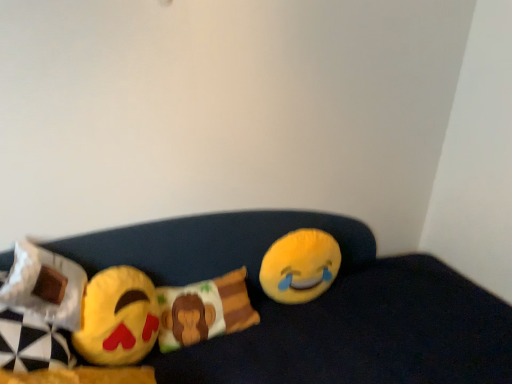
Question: From a real-world perspective, is yellow plush at right, positioned as the second toy in left-to-right order, under white fabric pillow at left, the 1th pillow viewed from the front?

Choices:
 (A) no
 (B) yes

Answer: (B)

Question: Is yellow plush at right, the second toy when ordered from front to back, positioned far away from white fabric pillow at left, the 1th pillow viewed from the front?

Choices:
 (A) yes
 (B) no

Answer: (B)

Question: Considering the relative sizes of yellow plush at right, positioned as the second toy in left-to-right order, and white fabric pillow at left, positioned as the second pillow in right-to-left order, in the image provided, is yellow plush at right, positioned as the second toy in left-to-right order, taller than white fabric pillow at left, positioned as the second pillow in right-to-left order,?

Choices:
 (A) yes
 (B) no

Answer: (A)

Question: Does yellow plush at right, the 1th toy viewed from the right, come behind white fabric pillow at left, acting as the second pillow starting from the back?

Choices:
 (A) yes
 (B) no

Answer: (A)

Question: Can you confirm if yellow plush at right, the 1th toy viewed from the right, is positioned to the left of white fabric pillow at left, acting as the second pillow starting from the back?

Choices:
 (A) no
 (B) yes

Answer: (A)

Question: Based on their positions, is fluffy cotton pillow with monkey design at center, placed as the first pillow when sorted from back to front, located to the left or right of yellow plush emoji at center?

Choices:
 (A) left
 (B) right

Answer: (A)

Question: Is point (184, 329) positioned closer to the camera than point (221, 268)?

Choices:
 (A) closer
 (B) farther

Answer: (A)

Question: From the image's perspective, is fluffy cotton pillow with monkey design at center, which ranks as the second pillow in left-to-right order, above or below yellow plush emoji at center?

Choices:
 (A) below
 (B) above

Answer: (B)

Question: From a real-world perspective, is fluffy cotton pillow with monkey design at center, which ranks as the second pillow in left-to-right order, positioned above or below yellow plush emoji at center?

Choices:
 (A) below
 (B) above

Answer: (B)

Question: Considering the relative positions of white fabric pillow at left, the first pillow viewed from the left, and yellow plush at right, the second toy when ordered from front to back, in the image provided, is white fabric pillow at left, the first pillow viewed from the left, to the left or to the right of yellow plush at right, the second toy when ordered from front to back,?

Choices:
 (A) right
 (B) left

Answer: (B)

Question: Is point (71, 329) positioned closer to the camera than point (328, 266)?

Choices:
 (A) farther
 (B) closer

Answer: (B)

Question: Is white fabric pillow at left, the 1th pillow viewed from the front, in front of or behind yellow plush at right, the second toy when ordered from front to back, in the image?

Choices:
 (A) behind
 (B) front

Answer: (B)

Question: From the image's perspective, is white fabric pillow at left, positioned as the second pillow in right-to-left order, positioned above or below yellow plush at right, the second toy when ordered from front to back?

Choices:
 (A) below
 (B) above

Answer: (B)

Question: From the image's perspective, is yellow plush at right, the 1th toy viewed from the right, above or below white fabric pillow at left, acting as the second pillow starting from the back?

Choices:
 (A) above
 (B) below

Answer: (B)

Question: From a real-world perspective, is yellow plush at right, positioned as the second toy in left-to-right order, positioned above or below white fabric pillow at left, acting as the second pillow starting from the back?

Choices:
 (A) below
 (B) above

Answer: (A)